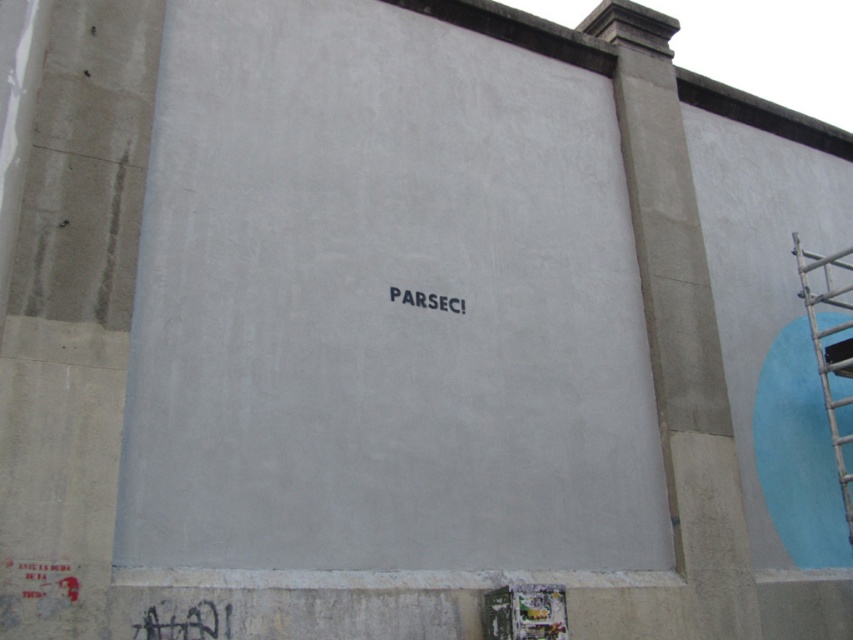
Question: Is wooden scaffolding at right positioned behind black matte text at center?

Choices:
 (A) no
 (B) yes

Answer: (B)

Question: Which of these objects is positioned farthest from the wooden scaffolding at right?

Choices:
 (A) black graffiti at lower left
 (B) black matte text at center

Answer: (A)

Question: In this image, where is wooden scaffolding at right located relative to black graffiti at lower left?

Choices:
 (A) above
 (B) below

Answer: (A)

Question: Which object is farther from the camera taking this photo?

Choices:
 (A) wooden scaffolding at right
 (B) black matte text at center

Answer: (A)

Question: Is the position of wooden scaffolding at right more distant than that of black matte text at center?

Choices:
 (A) yes
 (B) no

Answer: (A)

Question: Based on their relative distances, which object is farther from the black graffiti at lower left?

Choices:
 (A) black matte text at center
 (B) wooden scaffolding at right

Answer: (B)